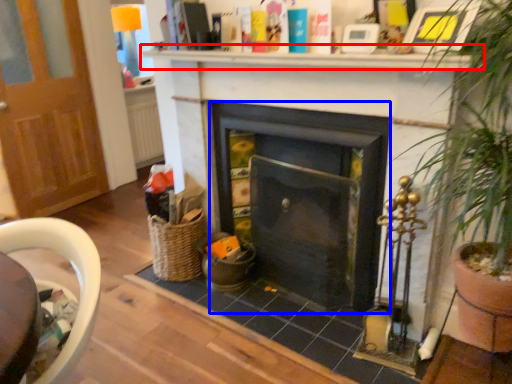
Question: Which point is further to the camera, mantle (highlighted by a red box) or fireplace (highlighted by a blue box)?

Choices:
 (A) mantle
 (B) fireplace

Answer: (B)